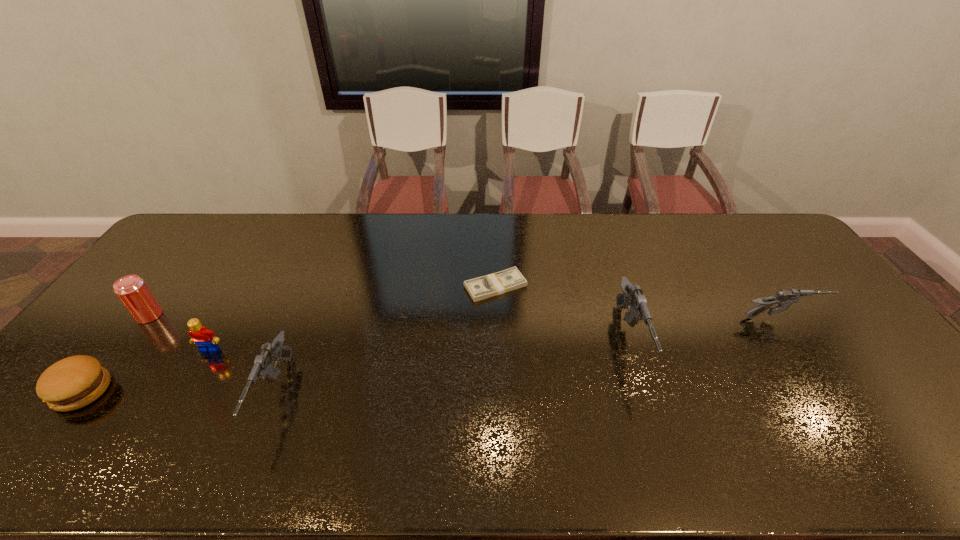
Find the location of a particular element. The height and width of the screenshot is (540, 960). vacant area that lies between the rightmost gun and the Lego is located at coordinates (495, 334).

In order to click on free space that is in between the sixth tallest object and the dollar in this screenshot , I will do `click(289, 339)`.

The width and height of the screenshot is (960, 540). What are the coordinates of `free space between the beer can and the fourth object from left to right` in the screenshot? It's located at (212, 355).

Identify the location of free area in between the fourth object from right to left and the beer can. The image size is (960, 540). (212, 355).

Locate an element on the screen. This screenshot has height=540, width=960. unoccupied area between the fifth object from left to right and the beer can is located at coordinates (323, 301).

Locate an element on the screen. free point between the fifth object from right to left and the beer can is located at coordinates (180, 333).

Where is `the fourth closest object to the second shortest object`? This screenshot has height=540, width=960. the fourth closest object to the second shortest object is located at coordinates (484, 287).

Identify which object is the closest to the dollar. Please provide its 2D coordinates. Your answer should be formatted as a tuple, i.e. [(x, y)], where the tuple contains the x and y coordinates of a point satisfying the conditions above.

[(632, 296)]

Choose which gun is the second nearest neighbor to the Lego. Please provide its 2D coordinates. Your answer should be formatted as a tuple, i.e. [(x, y)], where the tuple contains the x and y coordinates of a point satisfying the conditions above.

[(632, 296)]

Locate an element on the screen. gun that is the third closest one to the third object from right to left is located at coordinates (784, 298).